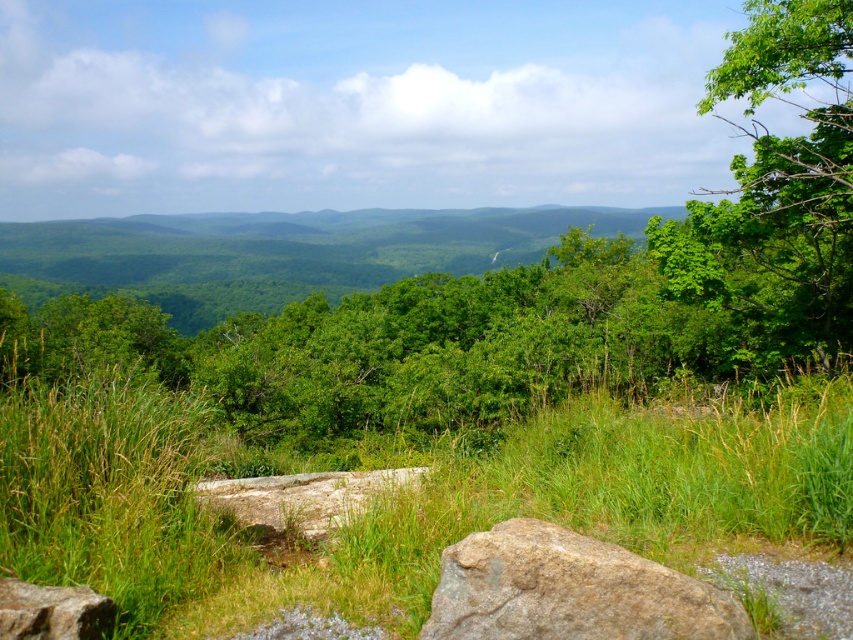
Between point (76, 387) and point (598, 579), which one is positioned behind?

Positioned behind is point (76, 387).

The width and height of the screenshot is (853, 640). What are the coordinates of `green grassy at center` in the screenshot? It's located at (403, 493).

Measure the distance between point (x=355, y=564) and camera.

Point (x=355, y=564) and camera are 15.40 feet apart from each other.

Find the location of a particular element. green grassy at center is located at coordinates (403, 493).

Is green leafy tree at upper right further to the viewer compared to brown rough rock at lower center?

That is True.

Describe the element at coordinates (776, 195) in the screenshot. I see `green leafy tree at upper right` at that location.

Locate an element on the screen. The image size is (853, 640). green leafy tree at upper right is located at coordinates (776, 195).

At what (x,y) coordinates should I click in order to perform the action: click on green leafy tree at upper right. Please return your answer as a coordinate pair (x, y). Looking at the image, I should click on (776, 195).

Does green leafy tree at upper right appear under brown rough boulder at lower left?

Incorrect, green leafy tree at upper right is not positioned below brown rough boulder at lower left.

Who is positioned more to the left, green leafy tree at upper right or brown rough boulder at lower left?

brown rough boulder at lower left is more to the left.

Is point (743, 310) positioned in front of point (53, 637)?

No, (743, 310) is further to viewer.

The image size is (853, 640). In order to click on green leafy tree at upper right in this screenshot , I will do `click(776, 195)`.